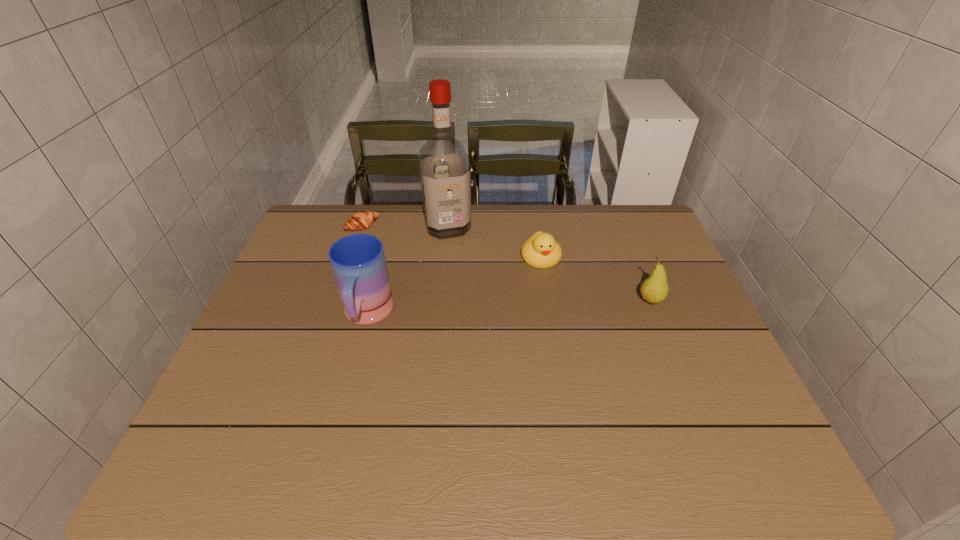
At what (x,y) coordinates should I click in order to perform the action: click on object that ranks as the fourth closest to the shortest object. Please return your answer as a coordinate pair (x, y). Looking at the image, I should click on (654, 289).

Find the location of a particular element. Image resolution: width=960 pixels, height=540 pixels. free space that satisfies the following two spatial constraints: 1. on the front side of the third tallest object; 2. on the right side of the liquor is located at coordinates (441, 301).

Find the location of a particular element. The height and width of the screenshot is (540, 960). free space that satisfies the following two spatial constraints: 1. on the front side of the second shortest object; 2. on the right side of the third shortest object is located at coordinates (548, 301).